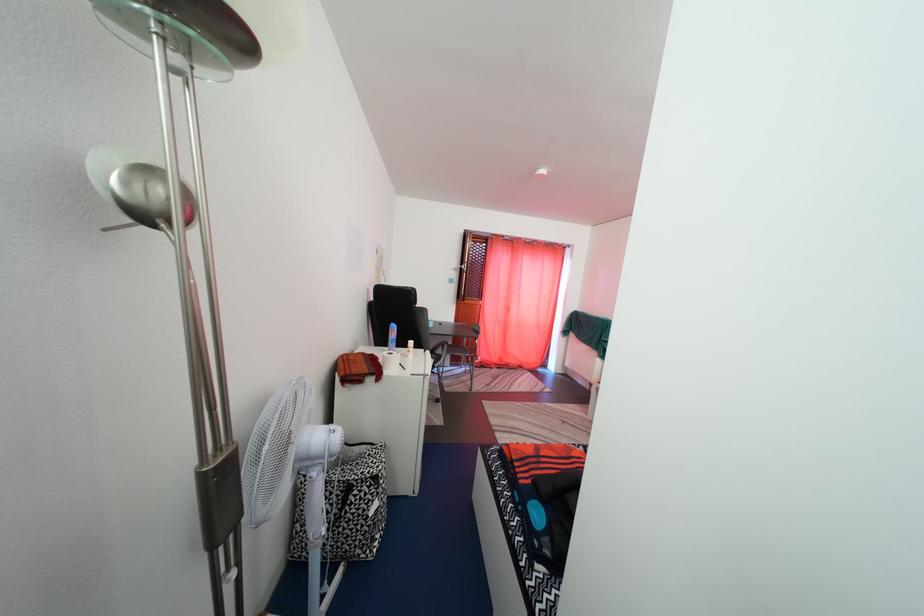
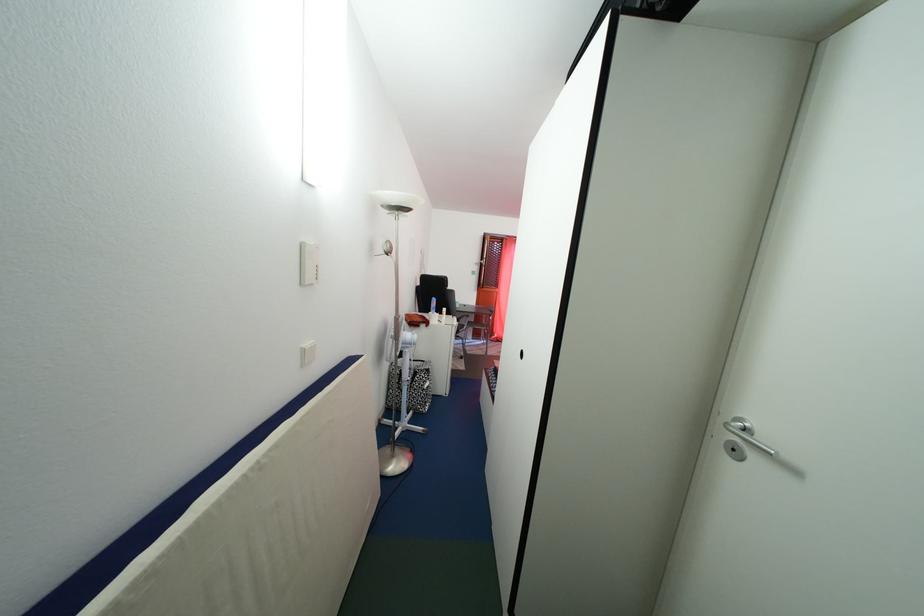
Find the pixel in the second image that matches [440,331] in the first image.

(466, 313)